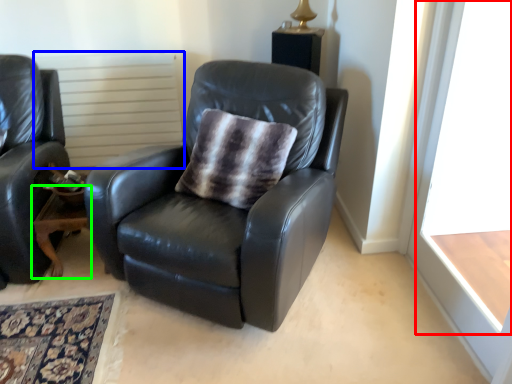
Question: Which object is the farthest from window frame (highlighted by a red box)? Choose among these: radiator (highlighted by a blue box) or table (highlighted by a green box).

Choices:
 (A) radiator
 (B) table

Answer: (A)